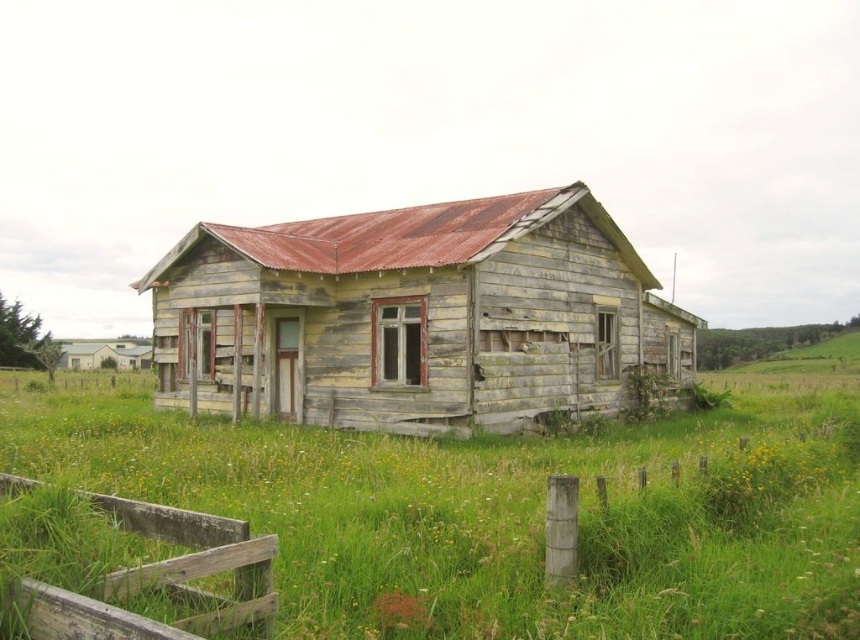
Is green grass at center to the left of weathered wood hut at center from the viewer's perspective?

Yes, green grass at center is to the left of weathered wood hut at center.

Who is more distant from viewer, (822, 442) or (438, 320)?

A: Point (438, 320)

Is point (720, 461) in front of point (535, 275)?

Yes, point (720, 461) is in front of point (535, 275).

Locate an element on the screen. green grass at center is located at coordinates (501, 513).

Is point (349, 474) more distant than point (212, 621)?

Yes, it is behind point (212, 621).

Can you confirm if green grass at center is smaller than weathered wood fence at lower left?

Incorrect, green grass at center is not smaller in size than weathered wood fence at lower left.

Where is `green grass at center`? The width and height of the screenshot is (860, 640). green grass at center is located at coordinates (501, 513).

Find the location of a particular element. This screenshot has width=860, height=640. green grass at center is located at coordinates (501, 513).

Which of these two, weathered wood hut at center or weathered wood fence at lower left, stands taller?

weathered wood hut at center

Who is more distant from viewer, (363,356) or (265,582)?

The point (363,356) is more distant.

Is point (455, 209) positioned behind point (269, 572)?

Yes, it is behind point (269, 572).

The image size is (860, 640). What are the coordinates of `weathered wood hut at center` in the screenshot? It's located at [415, 316].